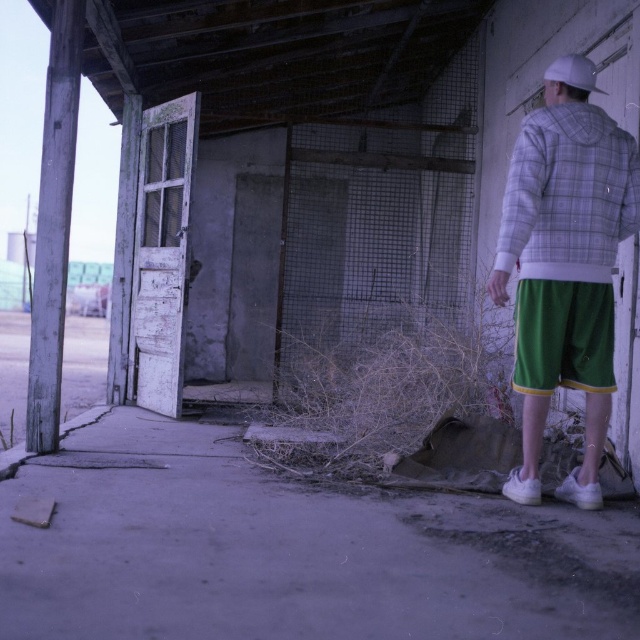
You are standing outside the abandoned building and want to reach the point marked at coordinates point (572, 237). The path to this point is clear of debris. Can you safely walk to that point without needing to step over or around any obstacles?

Yes, you can safely walk to the point (572, 237) because the path to it is clear of debris as stated.

From the picture: You are a person standing outside the building and want to place both the green cotton shorts at right and the white matte baseball hat at upper right on the concrete ground outside. Which object should you place first if you want to place them in order from largest to smallest?

The green cotton shorts at right should be placed first because it has a larger size compared to the white matte baseball hat at upper right.

You are a person who is 5 feet 6 inches tall. You are standing outside the building and see the white plaid hoodie at right and the white matte baseball hat at upper right. If you want to pick up both items, which one should you reach for first without moving your feet?

The white plaid hoodie at right is closer to you at 29.15 inches away from the white matte baseball hat at upper right, so you should reach for the white plaid hoodie at right first.